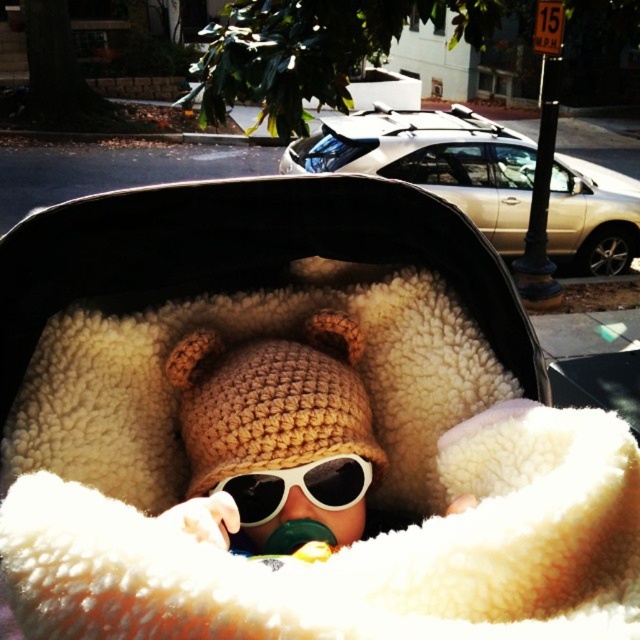
Who is lower down, crochet hat at center or gold metallic car at upper center?

crochet hat at center is below.

Does crochet hat at center have a larger size compared to gold metallic car at upper center?

Actually, crochet hat at center might be smaller than gold metallic car at upper center.

At what (x,y) coordinates should I click in order to perform the action: click on crochet hat at center. Please return your answer as a coordinate pair (x, y). Looking at the image, I should click on (275, 436).

Does point (572, 218) come closer to viewer compared to point (371, 468)?

That is False.

Image resolution: width=640 pixels, height=640 pixels. What do you see at coordinates (433, 161) in the screenshot?
I see `gold metallic car at upper center` at bounding box center [433, 161].

Locate an element on the screen. gold metallic car at upper center is located at coordinates (433, 161).

This screenshot has height=640, width=640. What are the coordinates of `gold metallic car at upper center` in the screenshot? It's located at pyautogui.click(x=433, y=161).

Does fuzzy beige baby carriage at center have a larger size compared to gold metallic car at upper center?

Actually, fuzzy beige baby carriage at center might be smaller than gold metallic car at upper center.

Which is above, fuzzy beige baby carriage at center or gold metallic car at upper center?

gold metallic car at upper center is higher up.

Image resolution: width=640 pixels, height=640 pixels. Identify the location of fuzzy beige baby carriage at center. (294, 424).